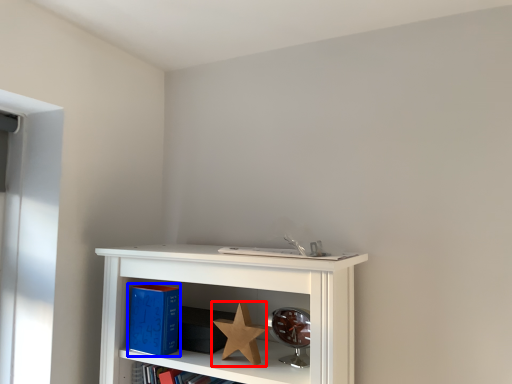
Question: Which of the following is the closest to the observer, star (highlighted by a red box) or paperback book (highlighted by a blue box)?

Choices:
 (A) star
 (B) paperback book

Answer: (A)